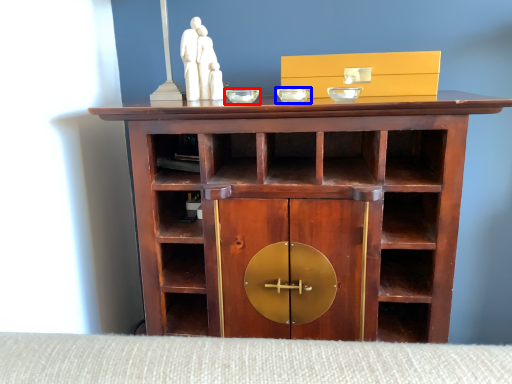
Question: Among these objects, which one is nearest to the camera, glass bowl (highlighted by a red box) or glass bowl (highlighted by a blue box)?

Choices:
 (A) glass bowl
 (B) glass bowl

Answer: (B)